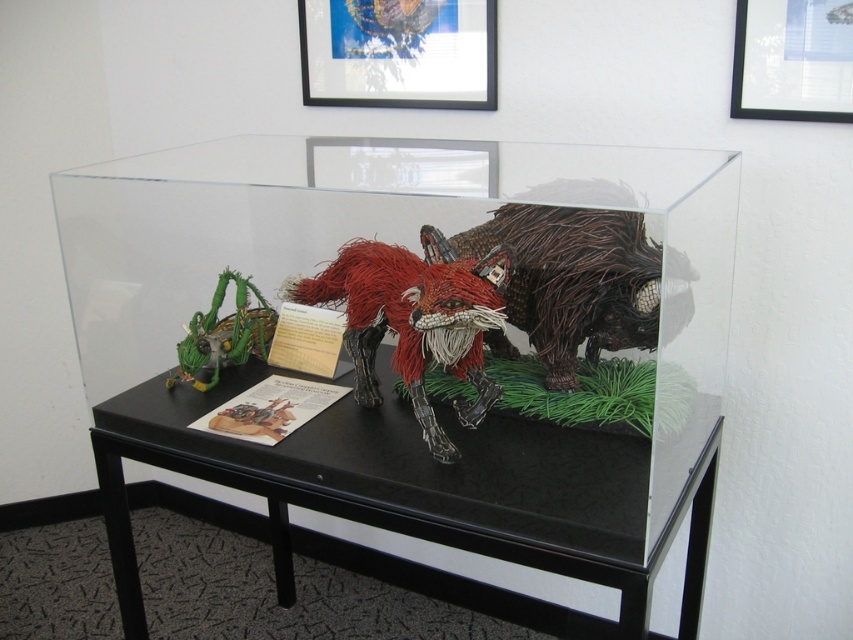
Question: Which of these objects is positioned closest to the clear acrylic box at center?

Choices:
 (A) matte black picture frame at upper right
 (B) green woven grasshopper at lower left
 (C) matte black picture frame at upper center

Answer: (B)

Question: Which of these objects is positioned farthest from the clear acrylic box at center?

Choices:
 (A) matte black picture frame at upper center
 (B) matte black picture frame at upper right

Answer: (B)

Question: Can you confirm if wire sculpture at center is positioned to the right of matte black picture frame at upper center?

Choices:
 (A) yes
 (B) no

Answer: (A)

Question: Considering the real-world distances, which object is closest to the green woven grasshopper at lower left?

Choices:
 (A) clear acrylic box at center
 (B) matte black picture frame at upper right
 (C) red wire fox at center
 (D) matte black picture frame at upper center

Answer: (C)

Question: Can you confirm if red wire fox at center is wider than green woven grasshopper at lower left?

Choices:
 (A) yes
 (B) no

Answer: (A)

Question: Does red wire fox at center appear on the left side of matte black picture frame at upper center?

Choices:
 (A) yes
 (B) no

Answer: (A)